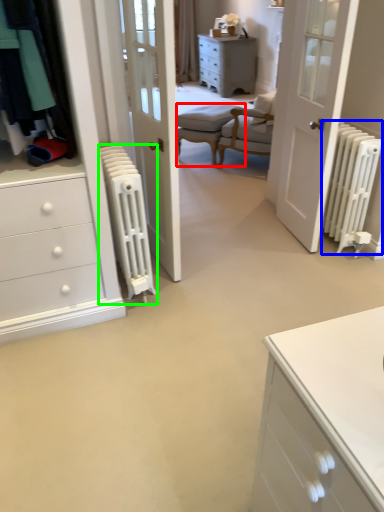
Question: Which is nearer to the armchair (highlighted by a red box)? radiator (highlighted by a blue box) or radiator (highlighted by a green box).

Choices:
 (A) radiator
 (B) radiator

Answer: (A)